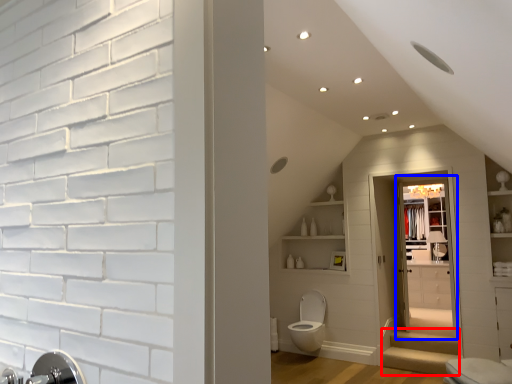
Question: Which point is closer to the camera, stairwell (highlighted by a red box) or glass door (highlighted by a blue box)?

Choices:
 (A) stairwell
 (B) glass door

Answer: (A)